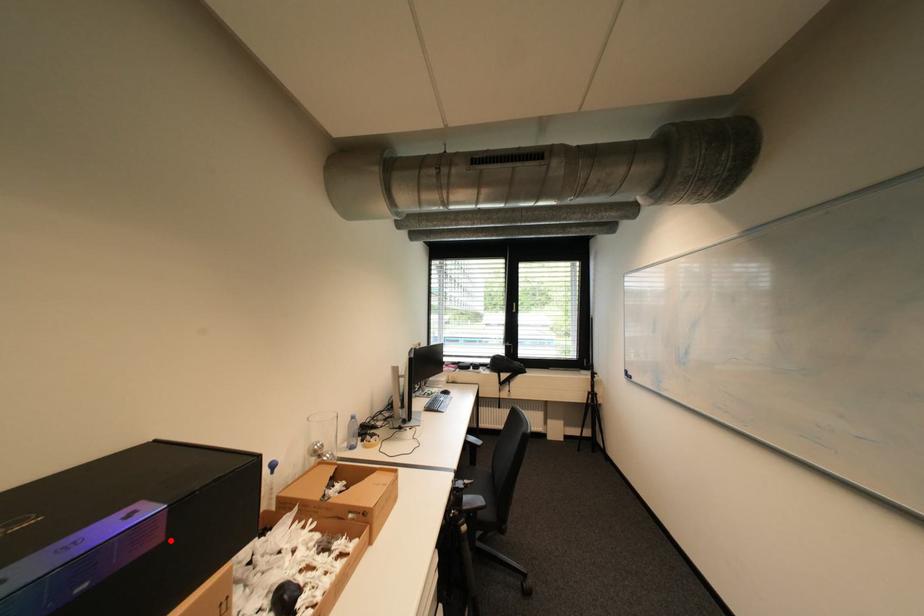
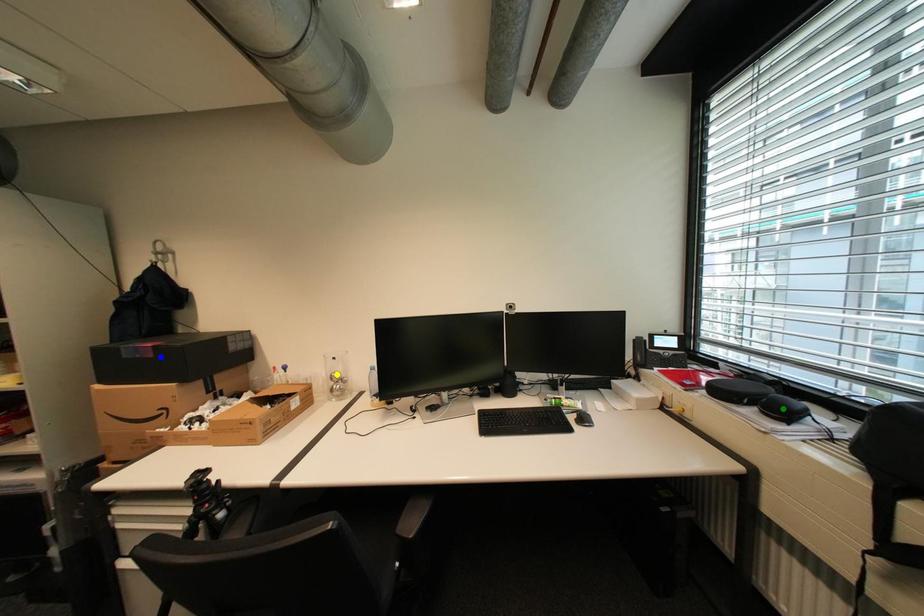
Question: I am providing you with two images of the same scene from different viewpoints. A red point is marked on the first image. You are given multiple points on the second image. Can you choose the point in image 2 that corresponds to the point in image 1?

Choices:
 (A) blue point
 (B) yellow point
 (C) green point

Answer: (A)